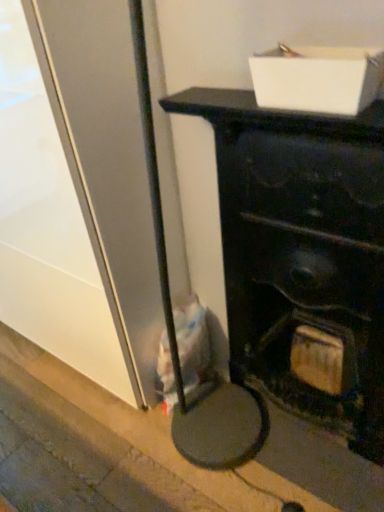
Question: Is matte black fireplace at center a part of white cardboard box at upper center?

Choices:
 (A) no
 (B) yes

Answer: (A)

Question: Is white cardboard box at upper center smaller than matte black fireplace at center?

Choices:
 (A) no
 (B) yes

Answer: (B)

Question: From the image's perspective, is white cardboard box at upper center over matte black fireplace at center?

Choices:
 (A) yes
 (B) no

Answer: (A)

Question: Can you confirm if white cardboard box at upper center is bigger than matte black fireplace at center?

Choices:
 (A) no
 (B) yes

Answer: (A)

Question: Is white cardboard box at upper center taller than matte black fireplace at center?

Choices:
 (A) yes
 (B) no

Answer: (B)

Question: Is white cardboard box at upper center shorter than matte black fireplace at center?

Choices:
 (A) yes
 (B) no

Answer: (A)

Question: Are concrete at lower left and matte black fireplace at center beside each other?

Choices:
 (A) yes
 (B) no

Answer: (B)

Question: Is concrete at lower left wider than matte black fireplace at center?

Choices:
 (A) yes
 (B) no

Answer: (A)

Question: Is concrete at lower left smaller than matte black fireplace at center?

Choices:
 (A) yes
 (B) no

Answer: (A)

Question: Can you confirm if concrete at lower left is bigger than matte black fireplace at center?

Choices:
 (A) yes
 (B) no

Answer: (B)

Question: Considering the relative positions of concrete at lower left and matte black fireplace at center in the image provided, is concrete at lower left behind matte black fireplace at center?

Choices:
 (A) yes
 (B) no

Answer: (A)

Question: Is concrete at lower left shorter than matte black fireplace at center?

Choices:
 (A) no
 (B) yes

Answer: (B)

Question: Is concrete at lower left smaller than white cardboard box at upper center?

Choices:
 (A) no
 (B) yes

Answer: (A)